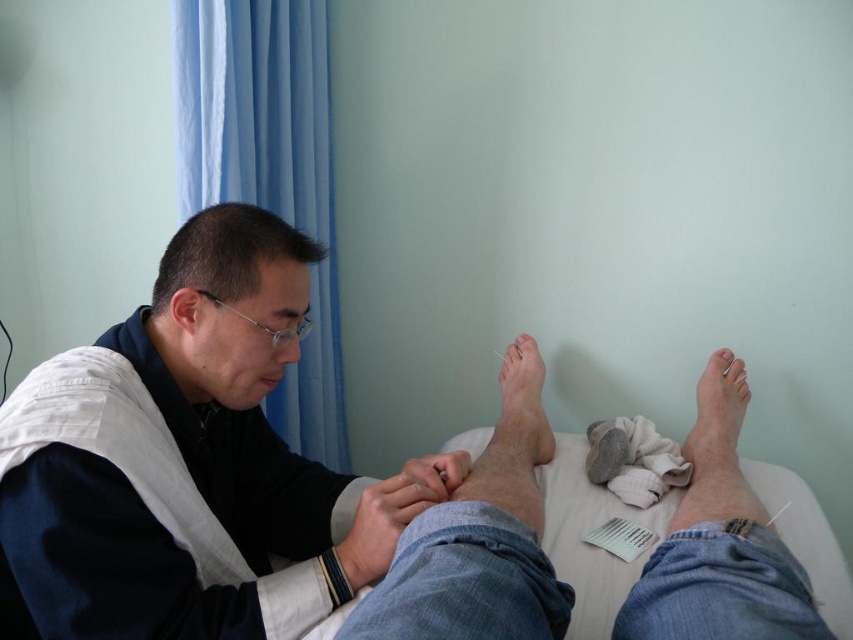
Does matte black shirt at center have a lesser width compared to pale skin foot at lower right?

Incorrect, matte black shirt at center's width is not less than pale skin foot at lower right's.

Is matte black shirt at center above pale skin foot at lower right?

Correct, matte black shirt at center is located above pale skin foot at lower right.

You are a GUI agent. You are given a task and a screenshot of the screen. Output one action in this format:
    pyautogui.click(x=<x>, y=<y>)
    Task: Click on the matte black shirt at center
    This screenshot has width=853, height=640.
    Given the screenshot: What is the action you would take?
    [189, 464]

Is pale skin foot at lower right bigger than gray fabric sock at lower right?

Indeed, pale skin foot at lower right has a larger size compared to gray fabric sock at lower right.

Which is more to the left, pale skin foot at lower right or gray fabric sock at lower right?

From the viewer's perspective, gray fabric sock at lower right appears more on the left side.

Where is `pale skin foot at lower right`? This screenshot has width=853, height=640. pale skin foot at lower right is located at coordinates (717, 419).

Is point (183, 548) closer to viewer compared to point (525, 387)?

Yes, it is.

Between point (247, 353) and point (544, 449), which one is positioned in front?

Point (247, 353)

Locate an element on the screen. matte black shirt at center is located at coordinates (189, 464).